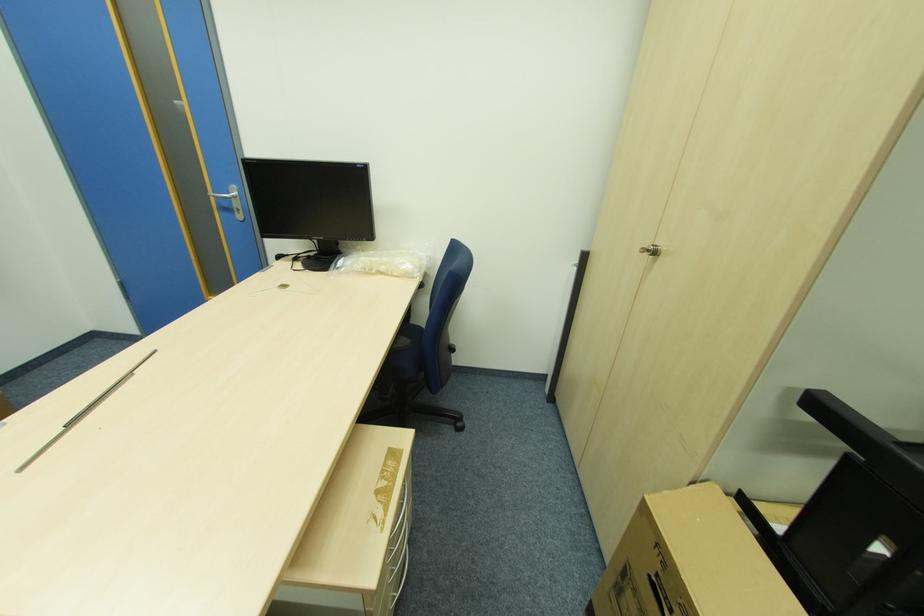
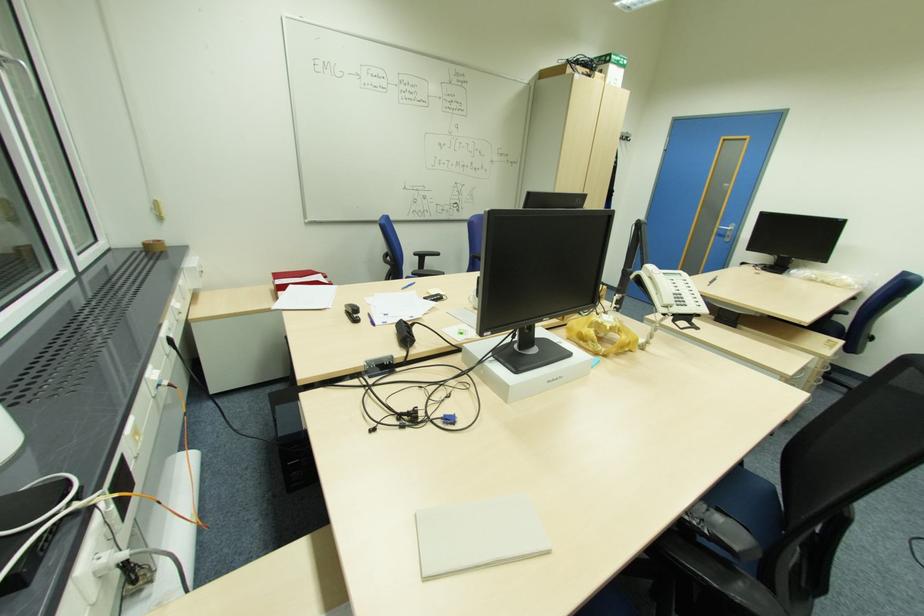
The point at (241, 209) is marked in the first image. Where is the corresponding point in the second image?

(732, 236)